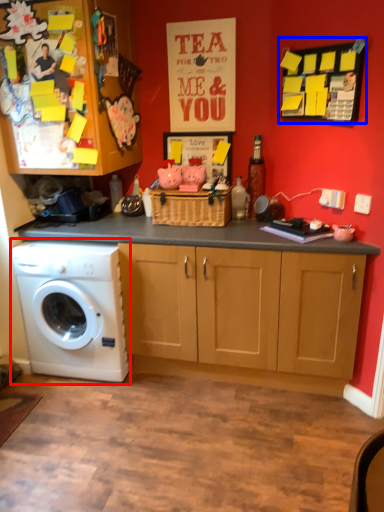
Question: Which of the following is the farthest to the observer, washing machine (highlighted by a red box) or bulletin board (highlighted by a blue box)?

Choices:
 (A) washing machine
 (B) bulletin board

Answer: (A)